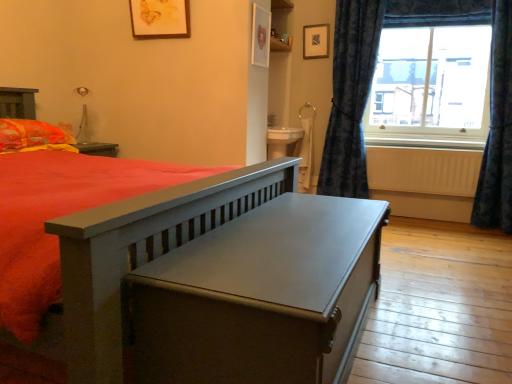
Question: From the image's perspective, is matte gray table at center located beneath orange/yellow fabric pillow at left?

Choices:
 (A) yes
 (B) no

Answer: (A)

Question: Can orange/yellow fabric pillow at left be found inside matte gray table at center?

Choices:
 (A) no
 (B) yes

Answer: (A)

Question: Is matte gray table at center directly adjacent to orange/yellow fabric pillow at left?

Choices:
 (A) no
 (B) yes

Answer: (A)

Question: Is matte gray table at center at the right side of orange/yellow fabric pillow at left?

Choices:
 (A) no
 (B) yes

Answer: (B)

Question: From a real-world perspective, is matte gray table at center physically above orange/yellow fabric pillow at left?

Choices:
 (A) yes
 (B) no

Answer: (B)

Question: Is matte gray table at center positioned beyond the bounds of orange/yellow fabric pillow at left?

Choices:
 (A) no
 (B) yes

Answer: (B)

Question: Can you confirm if matte gray table at center is shorter than white matte radiator at lower right?

Choices:
 (A) yes
 (B) no

Answer: (B)

Question: Considering the relative positions of matte gray table at center and white matte radiator at lower right in the image provided, is matte gray table at center to the left of white matte radiator at lower right from the viewer's perspective?

Choices:
 (A) yes
 (B) no

Answer: (A)

Question: From the image's perspective, is matte gray table at center on top of white matte radiator at lower right?

Choices:
 (A) no
 (B) yes

Answer: (A)

Question: Can you confirm if matte gray table at center is smaller than white matte radiator at lower right?

Choices:
 (A) yes
 (B) no

Answer: (B)

Question: Is matte gray table at center behind white matte radiator at lower right?

Choices:
 (A) no
 (B) yes

Answer: (A)

Question: Could white matte radiator at lower right be considered to be inside matte gray table at center?

Choices:
 (A) yes
 (B) no

Answer: (B)

Question: Is the depth of white painted wood at right less than that of blue textured curtain at right, the first curtain viewed from the left?

Choices:
 (A) yes
 (B) no

Answer: (B)